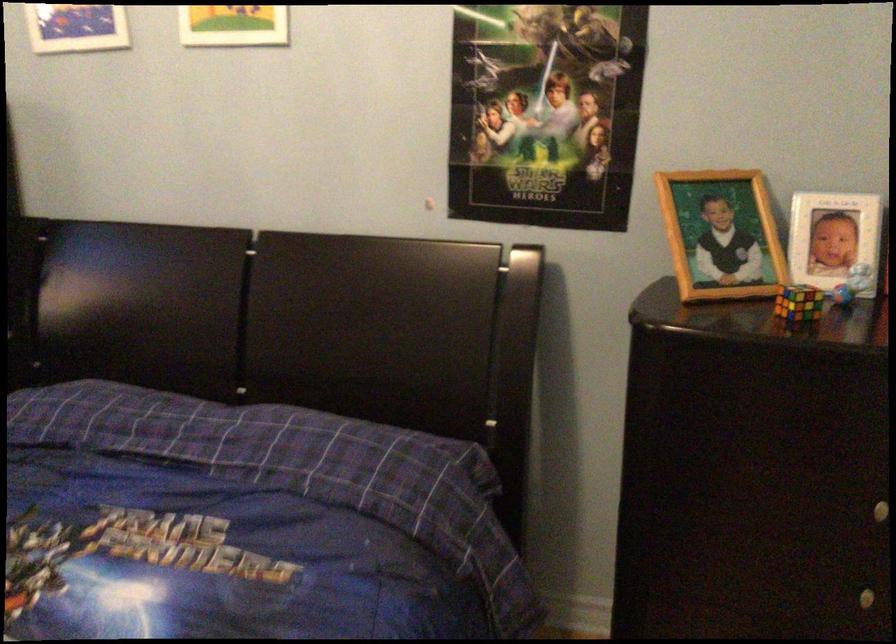
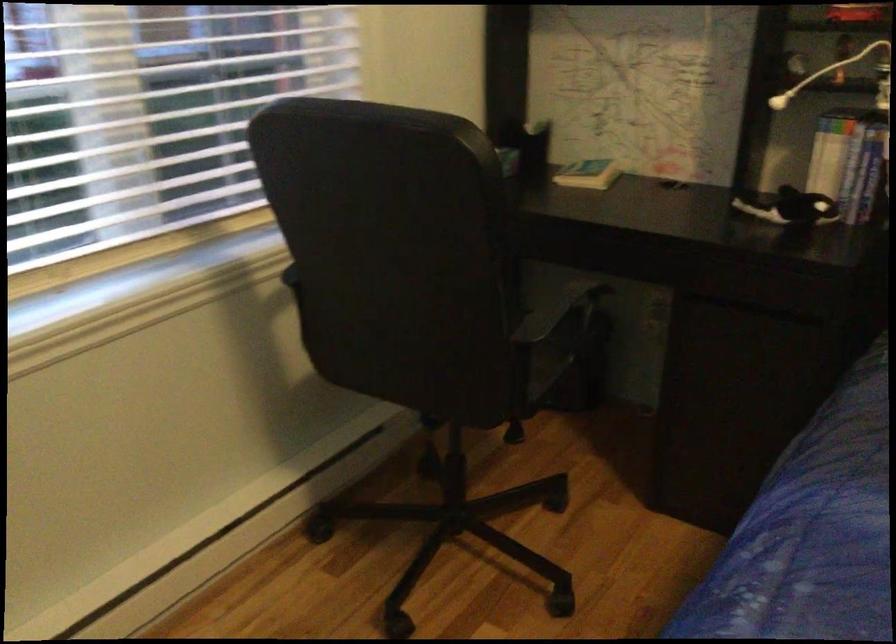
Question: Which direction would the cameraman need to move to produce the second image? Reply with the corresponding letter.

Choices:
 (A) Left
 (B) Right
 (C) Forward
 (D) Backward

Answer: (A)